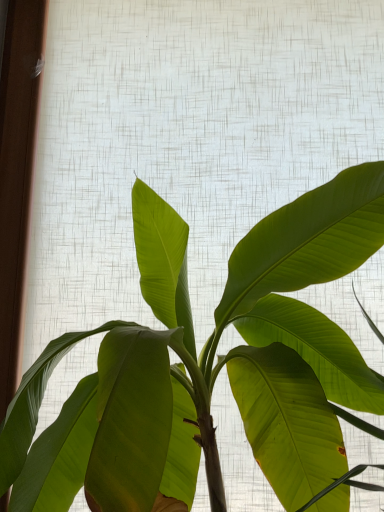
The width and height of the screenshot is (384, 512). What do you see at coordinates (211, 368) in the screenshot? I see `green leafy plant at center` at bounding box center [211, 368].

This screenshot has width=384, height=512. I want to click on green leafy plant at center, so click(211, 368).

Where is `green leafy plant at center`? The image size is (384, 512). green leafy plant at center is located at coordinates (211, 368).